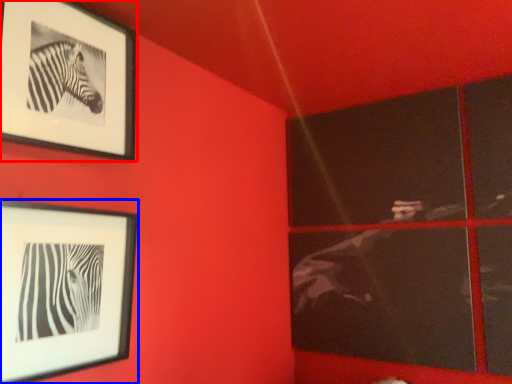
Question: Which of the following is the closest to the observer, picture frame (highlighted by a red box) or picture frame (highlighted by a blue box)?

Choices:
 (A) picture frame
 (B) picture frame

Answer: (B)